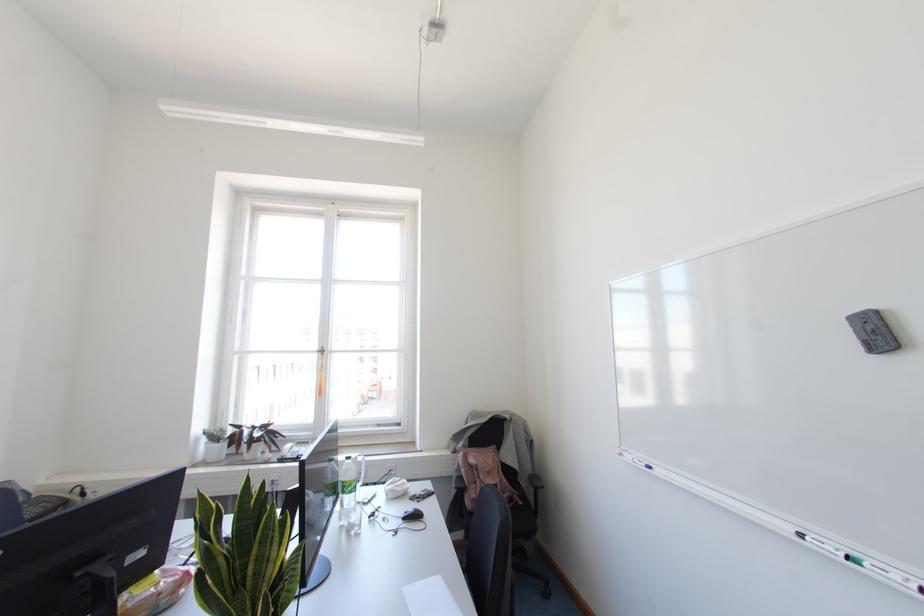
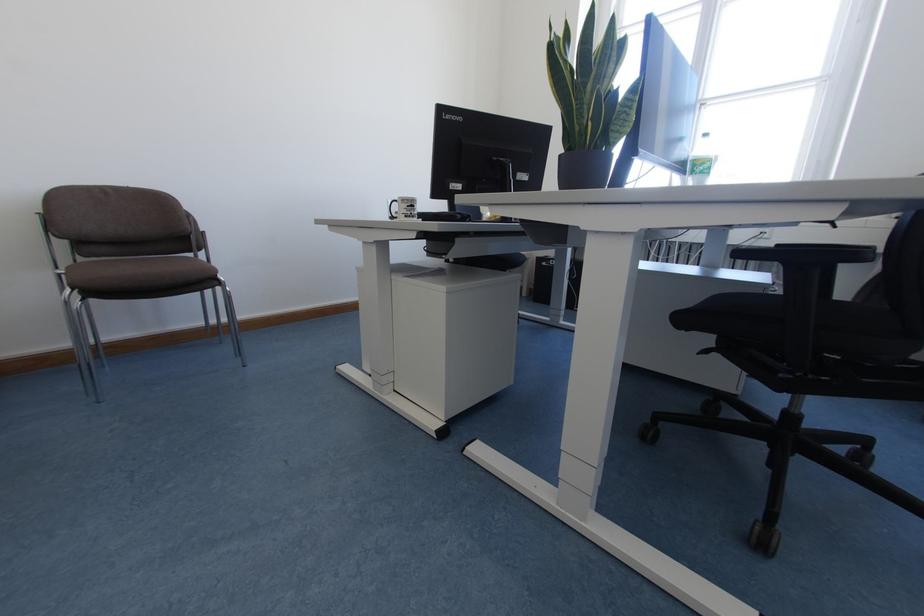
Locate, in the second image, the point that corresponds to point (343, 485) in the first image.

(694, 164)